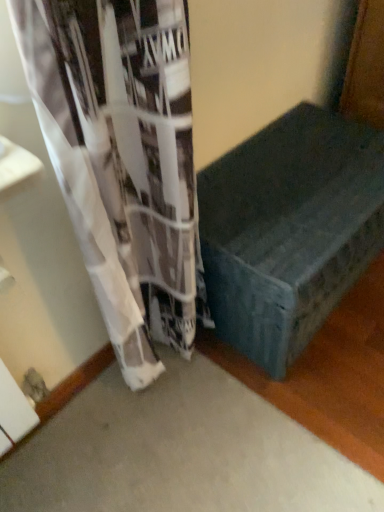
Describe the element at coordinates (289, 230) in the screenshot. This screenshot has height=512, width=384. I see `rustic wood bench at lower right` at that location.

Find the location of `rustic wood bench at lower right`. rustic wood bench at lower right is located at coordinates (289, 230).

At what (x,y) coordinates should I click in order to perform the action: click on rustic wood bench at lower right. Please return your answer as a coordinate pair (x, y). The height and width of the screenshot is (512, 384). Looking at the image, I should click on (289, 230).